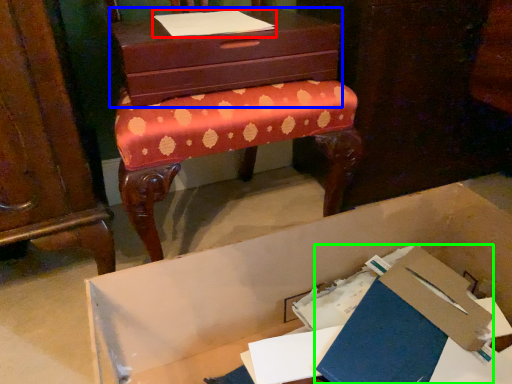
Question: Considering the real-world distances, which object is closest to notebook (highlighted by a red box)? chest of drawers (highlighted by a blue box) or paperback book (highlighted by a green box).

Choices:
 (A) chest of drawers
 (B) paperback book

Answer: (A)